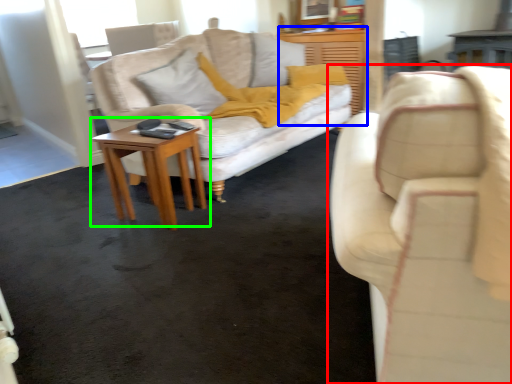
Question: Which object is the farthest from studio couch (highlighted by a red box)? Choose among these: dresser (highlighted by a blue box) or table (highlighted by a green box).

Choices:
 (A) dresser
 (B) table

Answer: (A)